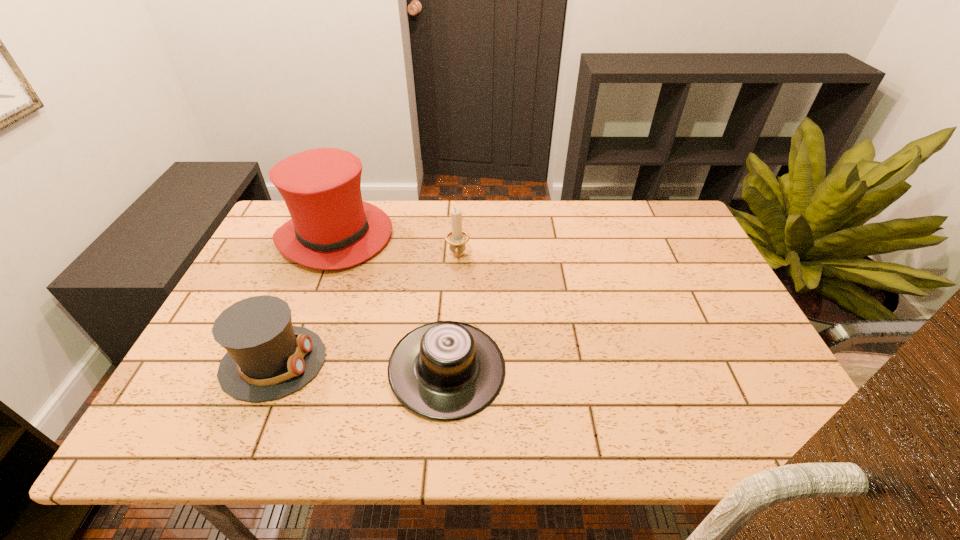
Identify which object is the nearest to the tallest object. Please provide its 2D coordinates. Your answer should be formatted as a tuple, i.e. [(x, y)], where the tuple contains the x and y coordinates of a point satisfying the conditions above.

[(457, 238)]

This screenshot has height=540, width=960. Find the location of `dress hat that is the closest to the candle_holder`. dress hat that is the closest to the candle_holder is located at coordinates (331, 228).

At what (x,y) coordinates should I click in order to perform the action: click on dress hat object that ranks as the closest to the tallest dress hat. Please return your answer as a coordinate pair (x, y). Looking at the image, I should click on (267, 358).

I want to click on free space that satisfies the following two spatial constraints: 1. on the front side of the tallest object; 2. with goggles on the front of the second shortest dress hat, so click(286, 362).

You are a GUI agent. You are given a task and a screenshot of the screen. Output one action in this format:
    pyautogui.click(x=<x>, y=<y>)
    Task: Click on the free region that satisfies the following two spatial constraints: 1. on the handle side of the candle_holder; 2. with goggles on the front of the second shortest dress hat
    This screenshot has width=960, height=540.
    Given the screenshot: What is the action you would take?
    pyautogui.click(x=452, y=362)

Locate an element on the screen. The width and height of the screenshot is (960, 540). blank space that satisfies the following two spatial constraints: 1. on the back side of the shortest dress hat; 2. with goggles on the front of the second tallest dress hat is located at coordinates (448, 362).

Find the location of a particular element. Image resolution: width=960 pixels, height=540 pixels. vacant area that satisfies the following two spatial constraints: 1. on the front side of the tallest object; 2. on the left side of the shortest dress hat is located at coordinates (283, 369).

Locate an element on the screen. vacant area that satisfies the following two spatial constraints: 1. on the front side of the shortest object; 2. on the left side of the tallest object is located at coordinates (283, 369).